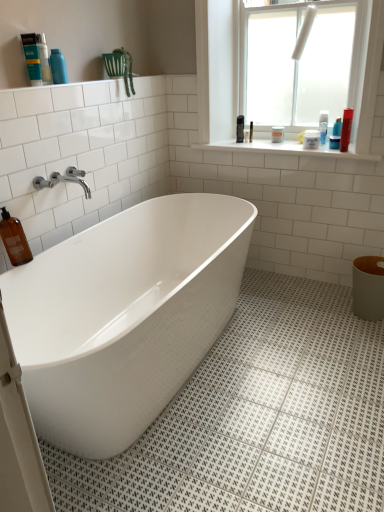
Question: Considering the positions of brown glass bottle at lower left, the fourth cleaning product in the right-to-left sequence, and matte blue bottle at upper left, arranged as the second cleaning product when viewed from the back, in the image, is brown glass bottle at lower left, the fourth cleaning product in the right-to-left sequence, taller or shorter than matte blue bottle at upper left, arranged as the second cleaning product when viewed from the back,?

Choices:
 (A) short
 (B) tall

Answer: (B)

Question: Is point (6, 238) closer or farther from the camera than point (44, 79)?

Choices:
 (A) closer
 (B) farther

Answer: (A)

Question: Which is nearer to the shiny plastic bottle at upper right, acting as the 2th cleaning product starting from the bottom?

Choices:
 (A) white matte jar at upper right, which is the third toiletry from back to front
 (B) chrome metallic faucet at upper left
 (C) brown glass bottle at lower left, the 1th cleaning product positioned from the bottom
 (D) matte blue bottle at upper left, marked as the third cleaning product in a left-to-right arrangement
 (E) white frosted glass window at upper right

Answer: (A)

Question: Which is nearer to the white frosted glass window at upper right?

Choices:
 (A) white glossy bathtub at center
 (B) blue glossy bottle at upper left, marked as the 5th toiletry in a back-to-front arrangement
 (C) chrome metallic faucet at upper left
 (D) matte blue bottle at upper left, positioned as the 3th cleaning product in right-to-left order
 (E) blue glossy lotion at upper right, positioned as the second toiletry in front-to-back order

Answer: (E)